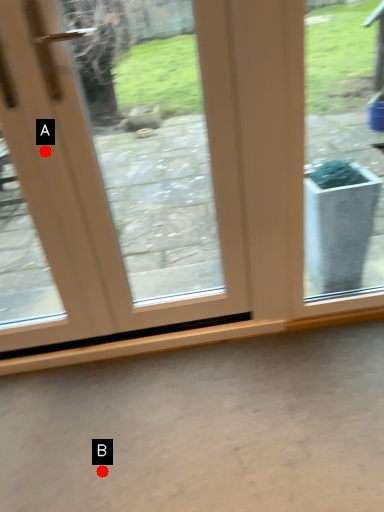
Question: Two points are circled on the image, labeled by A and B beside each circle. Which of the following is the closest to the observer?

Choices:
 (A) A is closer
 (B) B is closer

Answer: (B)